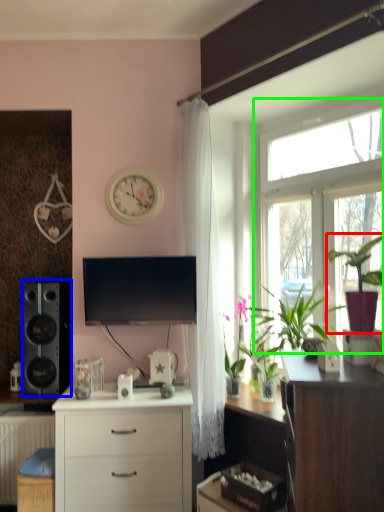
Question: Which object is the farthest from houseplant (highlighted by a red box)? Choose among these: loudspeaker (highlighted by a blue box) or window (highlighted by a green box).

Choices:
 (A) loudspeaker
 (B) window

Answer: (A)